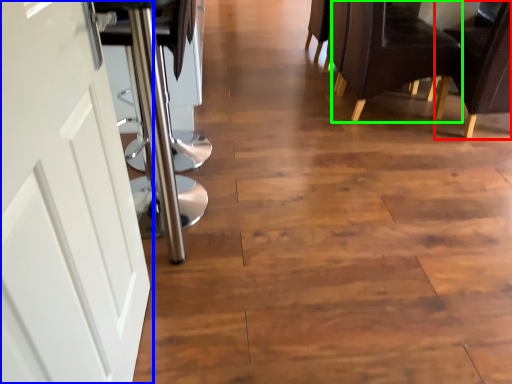
Question: Which is nearer to the chair (highlighted by a red box)? door (highlighted by a blue box) or chair (highlighted by a green box).

Choices:
 (A) door
 (B) chair

Answer: (B)